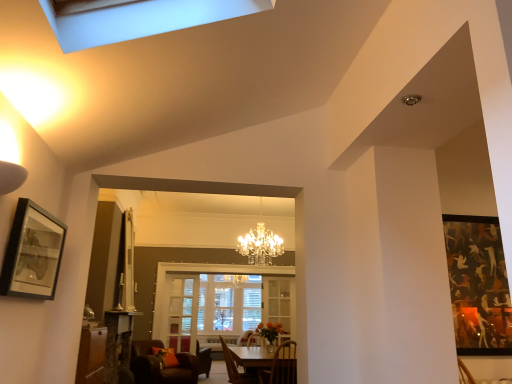
Question: Is clear glass door at center in front of wooden chair at lower center, placed as the 3th chair when sorted from left to right?

Choices:
 (A) yes
 (B) no

Answer: (B)

Question: Is clear glass door at center to the right of wooden chair at lower center, the 1th chair in the right-to-left sequence, from the viewer's perspective?

Choices:
 (A) yes
 (B) no

Answer: (B)

Question: Is clear glass door at center not within wooden chair at lower center, which appears as the first chair when viewed from the front?

Choices:
 (A) yes
 (B) no

Answer: (A)

Question: Is clear glass door at center facing towards wooden chair at lower center, which appears as the first chair when viewed from the front?

Choices:
 (A) no
 (B) yes

Answer: (A)

Question: Is clear glass door at center taller than wooden chair at lower center, placed as the 3th chair when sorted from left to right?

Choices:
 (A) yes
 (B) no

Answer: (A)

Question: Is wooden chair at lower center, which appears as the 3th chair when viewed from the back, wider or thinner than clear glass door at center?

Choices:
 (A) wide
 (B) thin

Answer: (A)

Question: From their relative heights in the image, would you say wooden chair at lower center, the 1th chair in the right-to-left sequence, is taller or shorter than clear glass door at center?

Choices:
 (A) short
 (B) tall

Answer: (A)

Question: Considering the relative positions of wooden chair at lower center, which appears as the 3th chair when viewed from the back, and clear glass door at center in the image provided, is wooden chair at lower center, which appears as the 3th chair when viewed from the back, to the left or to the right of clear glass door at center?

Choices:
 (A) left
 (B) right

Answer: (B)

Question: From a real-world perspective, is wooden chair at lower center, which appears as the first chair when viewed from the front, physically located above or below clear glass door at center?

Choices:
 (A) above
 (B) below

Answer: (B)

Question: Looking at the image, does wooden chair at lower center, the 1th chair in the right-to-left sequence, seem bigger or smaller compared to wooden chair at lower center, which appears as the second chair when viewed from the left?

Choices:
 (A) small
 (B) big

Answer: (A)

Question: Is point click(x=264, y=372) positioned closer to the camera than point click(x=250, y=375)?

Choices:
 (A) closer
 (B) farther

Answer: (A)

Question: In the image, is wooden chair at lower center, which appears as the first chair when viewed from the front, positioned in front of or behind wooden chair at lower center, which is the 2th chair from back to front?

Choices:
 (A) behind
 (B) front

Answer: (B)

Question: Choose the correct answer: Is wooden chair at lower center, the 1th chair in the right-to-left sequence, inside wooden chair at lower center, the 2th chair viewed from the front, or outside it?

Choices:
 (A) outside
 (B) inside

Answer: (A)

Question: Looking at their shapes, would you say wooden table at center is wider or thinner than wooden chair at lower center, the 2th chair in the right-to-left sequence?

Choices:
 (A) wide
 (B) thin

Answer: (A)

Question: In terms of height, does wooden table at center look taller or shorter compared to wooden chair at lower center, the 2th chair in the right-to-left sequence?

Choices:
 (A) tall
 (B) short

Answer: (B)